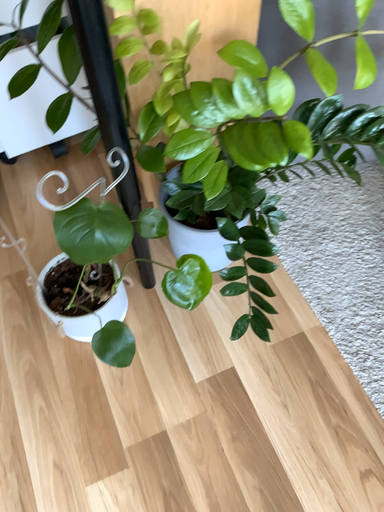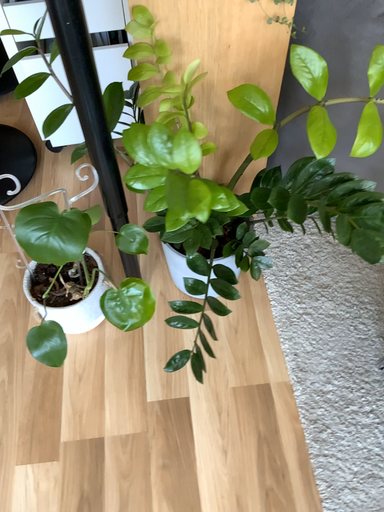
Question: Which way did the camera rotate in the video?

Choices:
 (A) rotated right
 (B) rotated left

Answer: (B)